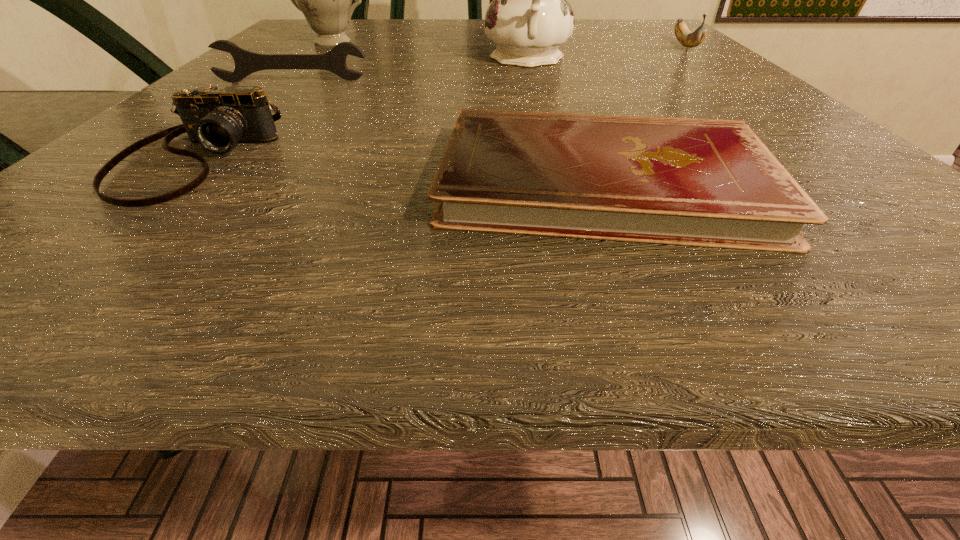
Locate an element on the screen. vacant region that satisfies the following two spatial constraints: 1. on the open ends of the notebook; 2. on the left side of the third nearest object is located at coordinates (193, 181).

Identify the location of free space that satisfies the following two spatial constraints: 1. on the spout of the shorter chinaware; 2. on the right side of the right chinaware. (315, 59).